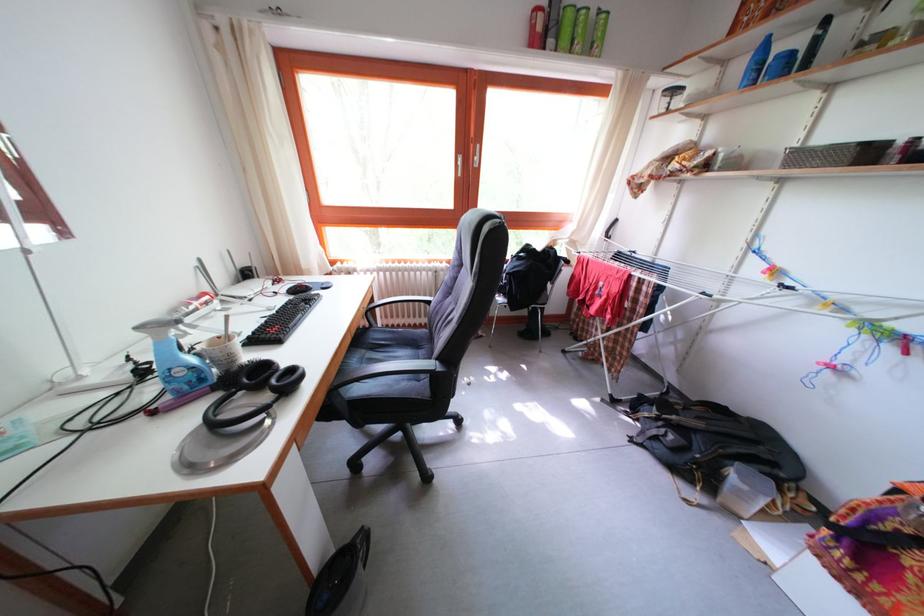
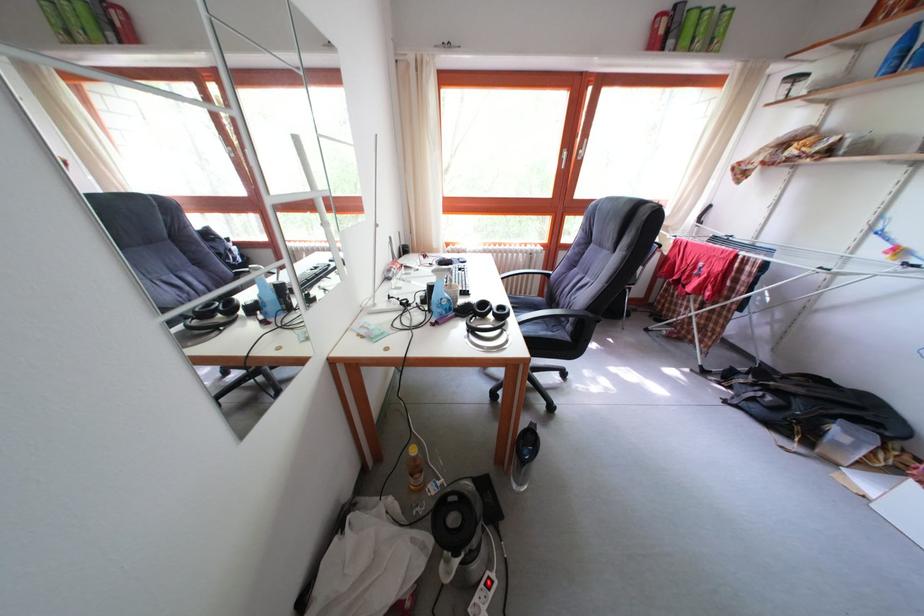
From the picture: In a continuous first-person perspective shot, in which direction is the camera moving?

The cameraman moved toward left, backward.